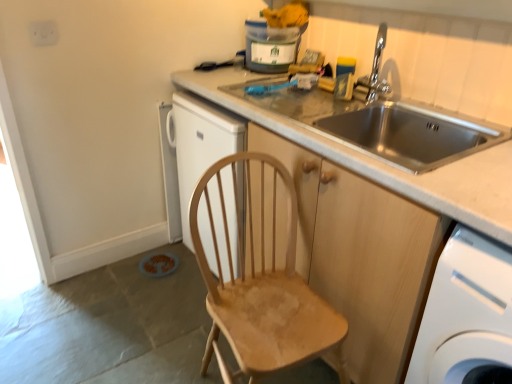
Question: Is wooden cabinet at center at the left side of stainless steel sink at upper right?

Choices:
 (A) yes
 (B) no

Answer: (A)

Question: Is wooden cabinet at center not close to stainless steel sink at upper right?

Choices:
 (A) yes
 (B) no

Answer: (B)

Question: Does wooden cabinet at center turn towards stainless steel sink at upper right?

Choices:
 (A) no
 (B) yes

Answer: (A)

Question: Is wooden cabinet at center thinner than stainless steel sink at upper right?

Choices:
 (A) no
 (B) yes

Answer: (A)

Question: Does wooden cabinet at center come in front of stainless steel sink at upper right?

Choices:
 (A) no
 (B) yes

Answer: (B)

Question: From a real-world perspective, is white plastic washing machine at lower right above or below wooden cabinet at center?

Choices:
 (A) below
 (B) above

Answer: (A)

Question: Considering the positions of white plastic washing machine at lower right and wooden cabinet at center in the image, is white plastic washing machine at lower right taller or shorter than wooden cabinet at center?

Choices:
 (A) tall
 (B) short

Answer: (B)

Question: Is white plastic washing machine at lower right bigger or smaller than wooden cabinet at center?

Choices:
 (A) big
 (B) small

Answer: (B)

Question: Is white plastic washing machine at lower right inside the boundaries of wooden cabinet at center, or outside?

Choices:
 (A) inside
 (B) outside

Answer: (B)

Question: In terms of size, does wooden cabinet at center appear bigger or smaller than white plastic washing machine at lower right?

Choices:
 (A) big
 (B) small

Answer: (A)

Question: Is wooden cabinet at center inside or outside of white plastic washing machine at lower right?

Choices:
 (A) inside
 (B) outside

Answer: (B)

Question: From a real-world perspective, relative to white plastic washing machine at lower right, is wooden cabinet at center vertically above or below?

Choices:
 (A) above
 (B) below

Answer: (A)

Question: From the image's perspective, is wooden cabinet at center located above or below white plastic washing machine at lower right?

Choices:
 (A) below
 (B) above

Answer: (B)

Question: In terms of width, does chrome metallic faucet at upper right look wider or thinner when compared to natural wood chair at center?

Choices:
 (A) thin
 (B) wide

Answer: (A)

Question: From the image's perspective, is chrome metallic faucet at upper right located above or below natural wood chair at center?

Choices:
 (A) below
 (B) above

Answer: (B)